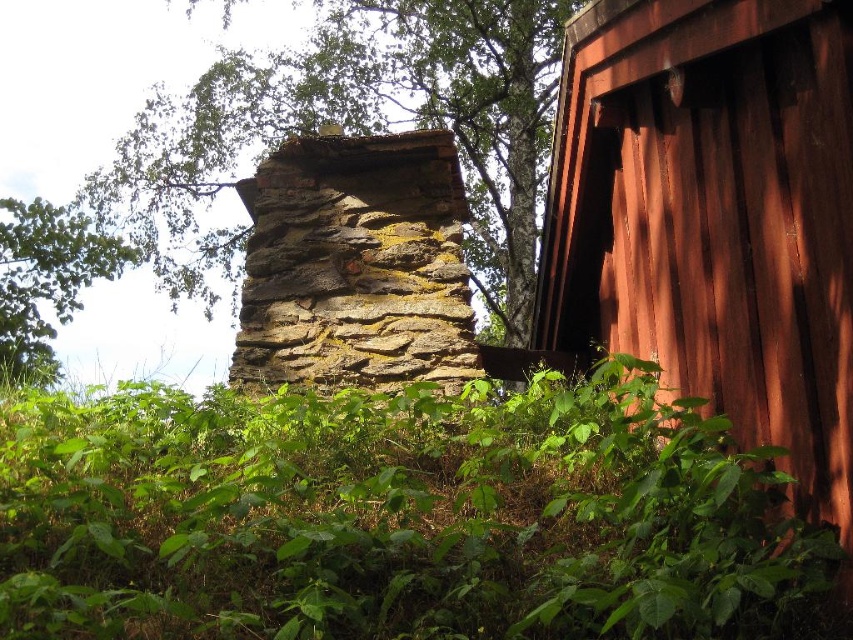
Question: Among these points, which one is farthest from the camera?

Choices:
 (A) (328, 198)
 (B) (831, 20)

Answer: (A)

Question: Does rusty wood cabin at right have a lesser width compared to green leafy tree at upper left?

Choices:
 (A) yes
 (B) no

Answer: (A)

Question: Does green leafy vegetation at center appear over green mossy stone at center?

Choices:
 (A) no
 (B) yes

Answer: (A)

Question: Which point is closer to the camera taking this photo?

Choices:
 (A) (283, 372)
 (B) (485, 0)
 (C) (138, 397)
 (D) (26, 243)

Answer: (C)

Question: Does green leafy vegetation at center have a lesser width compared to green leafy tree at upper left?

Choices:
 (A) yes
 (B) no

Answer: (B)

Question: Which point is farther to the camera?

Choices:
 (A) weathered stone chimney at center
 (B) green mossy stone at center

Answer: (B)